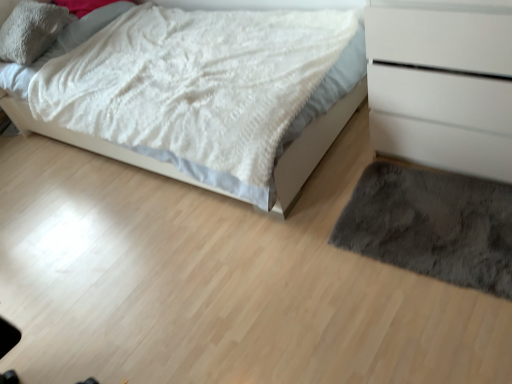
Locate an element on the screen. vacant region above dark gray shaggy rug at lower right (from a real-world perspective) is located at coordinates click(434, 223).